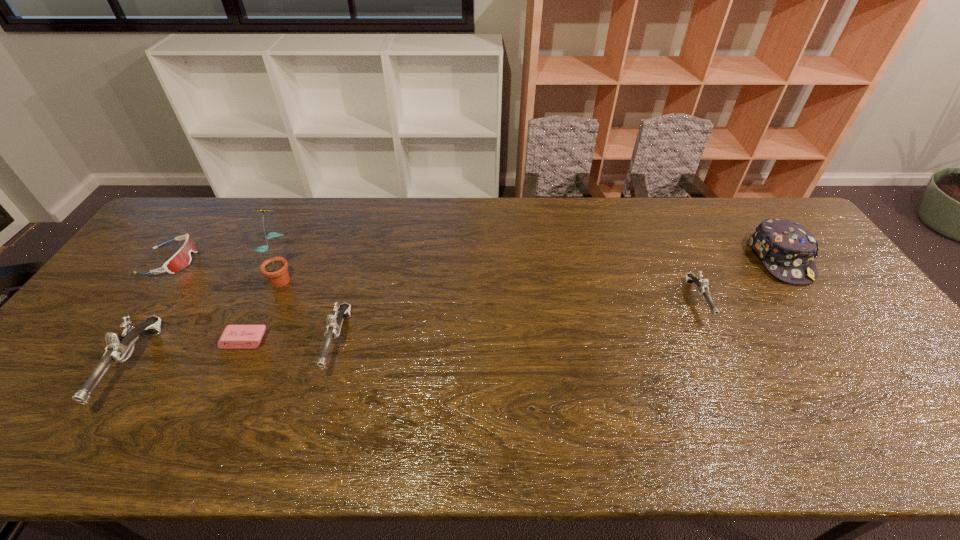
Image resolution: width=960 pixels, height=540 pixels. Find the location of `vacant area that lies between the tallest object and the second gun from left to right`. vacant area that lies between the tallest object and the second gun from left to right is located at coordinates (310, 309).

This screenshot has height=540, width=960. In order to click on free area in between the goggles and the shortest object in this screenshot , I will do `click(207, 301)`.

Locate an element on the screen. Image resolution: width=960 pixels, height=540 pixels. vacant area that lies between the second shortest object and the rightmost object is located at coordinates (475, 260).

The height and width of the screenshot is (540, 960). What are the coordinates of `vacant point located between the eraser and the tallest object` in the screenshot? It's located at (263, 308).

I want to click on object that is the third closest to the headwear, so click(x=275, y=268).

Identify which object is the fifth closest to the sunflower. Please provide its 2D coordinates. Your answer should be formatted as a tuple, i.e. [(x, y)], where the tuple contains the x and y coordinates of a point satisfying the conditions above.

[(701, 285)]

Identify the location of the second closest gun to the tallest object. (119, 348).

The width and height of the screenshot is (960, 540). What are the coordinates of `the closest gun relative to the tallest gun` in the screenshot? It's located at (334, 322).